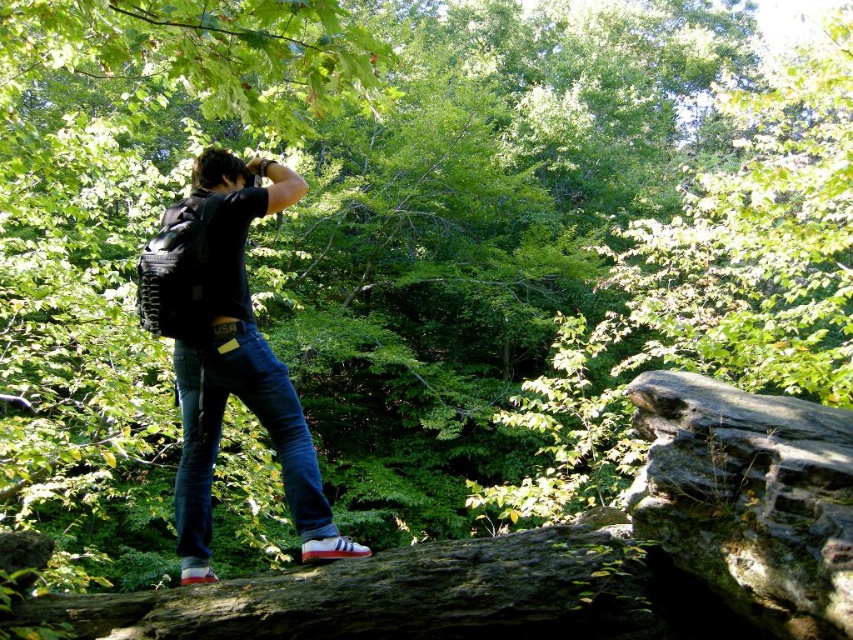
This screenshot has width=853, height=640. Describe the element at coordinates (395, 596) in the screenshot. I see `brown rough tree trunk at lower center` at that location.

Can you confirm if brown rough tree trunk at lower center is shorter than blue denim jeans at center?

Yes, brown rough tree trunk at lower center is shorter than blue denim jeans at center.

Describe the element at coordinates (395, 596) in the screenshot. Image resolution: width=853 pixels, height=640 pixels. I see `brown rough tree trunk at lower center` at that location.

The height and width of the screenshot is (640, 853). In order to click on brown rough tree trunk at lower center in this screenshot , I will do coord(395,596).

Who is lower down, brown rough tree trunk at lower center or denim jeans at center?

brown rough tree trunk at lower center is below.

In the scene shown: How distant is brown rough tree trunk at lower center from denim jeans at center?

brown rough tree trunk at lower center and denim jeans at center are 31.33 inches apart.

Is point (178, 595) in front of point (235, 378)?

Yes, it is in front of point (235, 378).

Where is `brown rough tree trunk at lower center`? The image size is (853, 640). brown rough tree trunk at lower center is located at coordinates (395, 596).

Is point (218, 376) positioned after point (281, 436)?

That is False.

Measure the distance between denim jeans at center and camera.

denim jeans at center and camera are 3.46 meters apart.

Is point (196, 360) positioned behind point (231, 342)?

Yes, point (196, 360) is behind point (231, 342).

This screenshot has height=640, width=853. I want to click on denim jeans at center, so (x=227, y=352).